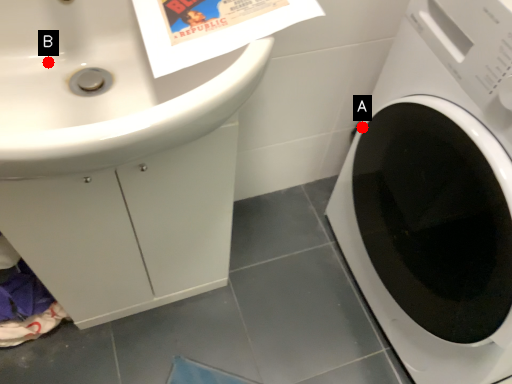
Question: Two points are circled on the image, labeled by A and B beside each circle. Which point is closer to the camera taking this photo?

Choices:
 (A) A is closer
 (B) B is closer

Answer: (B)